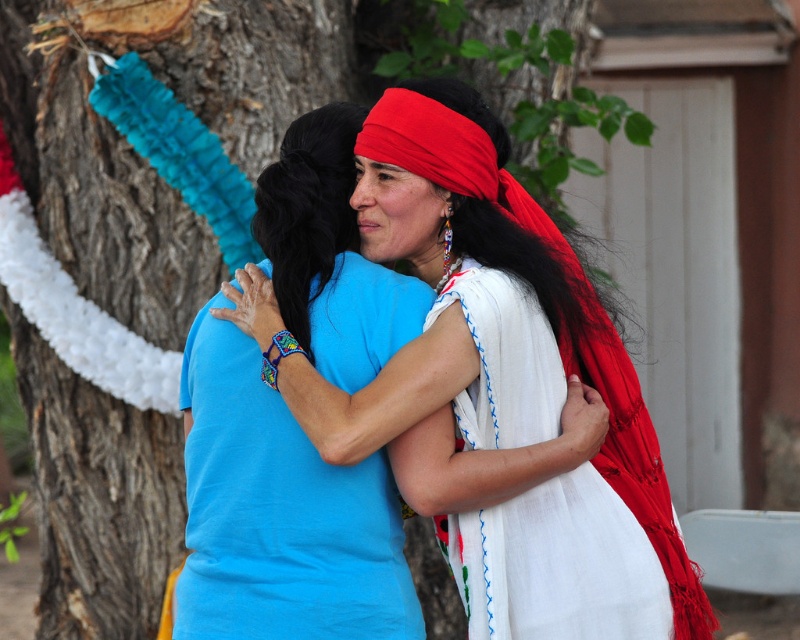
Does matte blue t-shirt at center come behind black silky hair at center?

No.

Who is taller, matte blue t-shirt at center or black silky hair at center?

Standing taller between the two is matte blue t-shirt at center.

Is point (328, 481) in front of point (258, 200)?

Yes, point (328, 481) is closer to viewer.

The height and width of the screenshot is (640, 800). I want to click on matte blue t-shirt at center, so click(x=280, y=513).

Can you confirm if matte blue t-shirt at center is shorter than white embroidered dress at center?

In fact, matte blue t-shirt at center may be taller than white embroidered dress at center.

Based on the photo, does matte blue t-shirt at center appear over white embroidered dress at center?

Correct, matte blue t-shirt at center is located above white embroidered dress at center.

Who is more forward, (x=320, y=336) or (x=550, y=336)?

Point (x=320, y=336)

Find the location of a particular element. This screenshot has width=800, height=640. matte blue t-shirt at center is located at coordinates (280, 513).

Is white embroidered dress at center behind black silky hair at center?

No.

Which is above, white embroidered dress at center or black silky hair at center?

black silky hair at center

What are the coordinates of `white embroidered dress at center` in the screenshot? It's located at (560, 563).